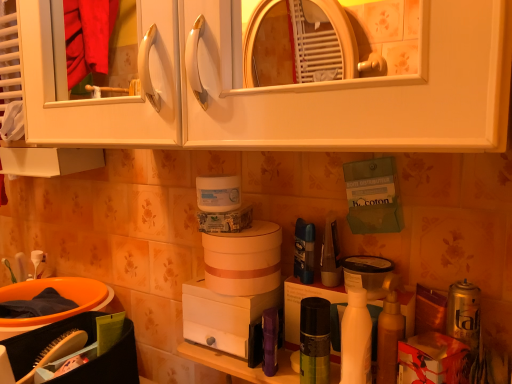
You are a GUI agent. You are given a task and a screenshot of the screen. Output one action in this format:
    pyautogui.click(x=<x>, y=<y>)
    Task: Click on the white matte cabinet at upper center
    Image resolution: width=512 pixels, height=384 pixels.
    Given the screenshot: What is the action you would take?
    pyautogui.click(x=274, y=85)

Describe the element at coordinates (356, 334) in the screenshot. I see `white matte bottle at center right` at that location.

This screenshot has height=384, width=512. What do you see at coordinates (270, 341) in the screenshot?
I see `purple fabric pouch at center, which appears as the 1th toiletry when viewed from the left` at bounding box center [270, 341].

Locate an element on the screen. white matte cabinet at upper center is located at coordinates (274, 85).

Which of these two, green matte spray can at center, placed as the 1th toiletry when sorted from right to left, or orange plastic basin at lower left, stands taller?

With more height is green matte spray can at center, placed as the 1th toiletry when sorted from right to left.

Which point is more forward, (x=328, y=333) or (x=15, y=325)?

Positioned in front is point (x=328, y=333).

Is green matte spray can at center, which ranks as the 2th toiletry in left-to-right order, completely or partially outside of orange plastic basin at lower left?

Absolutely, green matte spray can at center, which ranks as the 2th toiletry in left-to-right order, is external to orange plastic basin at lower left.

Which of these two, green matte spray can at center, placed as the 1th toiletry when sorted from right to left, or orange plastic basin at lower left, is wider?

orange plastic basin at lower left is wider.

Does orange plastic basin at lower left have a larger size compared to translucent plastic mouthwash at center right?

Yes, orange plastic basin at lower left is bigger than translucent plastic mouthwash at center right.

Between orange plastic basin at lower left and translucent plastic mouthwash at center right, which one has more height?

With more height is translucent plastic mouthwash at center right.

Is orange plastic basin at lower left in contact with translucent plastic mouthwash at center right?

No, orange plastic basin at lower left is not making contact with translucent plastic mouthwash at center right.

How far apart are orange plastic basin at lower left and translucent plastic mouthwash at center right?

orange plastic basin at lower left is 33.14 inches from translucent plastic mouthwash at center right.

Considering the relative sizes of translucent plastic mouthwash at center right and orange plastic basin at lower left in the image provided, is translucent plastic mouthwash at center right shorter than orange plastic basin at lower left?

No.

Based on the photo, would you say orange plastic basin at lower left is part of translucent plastic mouthwash at center right's contents?

No.

Which object is positioned more to the left, translucent plastic mouthwash at center right or orange plastic basin at lower left?

Positioned to the left is orange plastic basin at lower left.

From the image's perspective, which is below, translucent plastic mouthwash at center right or orange plastic basin at lower left?

orange plastic basin at lower left appears lower in the image.

Is purple fabric pouch at center, which is the second toiletry from right to left, smaller than orange plastic basin at lower left?

Indeed, purple fabric pouch at center, which is the second toiletry from right to left, has a smaller size compared to orange plastic basin at lower left.

Is orange plastic basin at lower left completely or partially inside purple fabric pouch at center, which appears as the 1th toiletry when viewed from the left?

No, orange plastic basin at lower left is located outside of purple fabric pouch at center, which appears as the 1th toiletry when viewed from the left.

Is the depth of purple fabric pouch at center, which is the second toiletry from right to left, greater than that of orange plastic basin at lower left?

No, the depth of purple fabric pouch at center, which is the second toiletry from right to left, is less than that of orange plastic basin at lower left.

Locate an element on the screen. The height and width of the screenshot is (384, 512). the 1st toiletry counting from the right of the orange plastic basin at lower left is located at coordinates (270, 341).

Does point (482, 100) come behind point (309, 379)?

No, (482, 100) is in front of (309, 379).

Is white matte cabinet at upper center directly adjacent to green matte spray can at center, which ranks as the 2th toiletry in left-to-right order?

No, white matte cabinet at upper center is not beside green matte spray can at center, which ranks as the 2th toiletry in left-to-right order.

Considering the sizes of objects white matte cabinet at upper center and green matte spray can at center, which ranks as the 2th toiletry in left-to-right order, in the image provided, who is thinner, white matte cabinet at upper center or green matte spray can at center, which ranks as the 2th toiletry in left-to-right order,?

green matte spray can at center, which ranks as the 2th toiletry in left-to-right order, is thinner.

Looking at this image, is white matte cabinet at upper center facing towards green matte spray can at center, which ranks as the 2th toiletry in left-to-right order?

No, white matte cabinet at upper center is not facing towards green matte spray can at center, which ranks as the 2th toiletry in left-to-right order.

Is white matte bottle at center right outside of green matte spray can at center, which ranks as the 2th toiletry in left-to-right order?

Yes, white matte bottle at center right is located beyond the bounds of green matte spray can at center, which ranks as the 2th toiletry in left-to-right order.

Could you tell me if white matte bottle at center right is facing green matte spray can at center, placed as the 1th toiletry when sorted from right to left?

No, white matte bottle at center right is not facing towards green matte spray can at center, placed as the 1th toiletry when sorted from right to left.

At what (x,y) coordinates should I click in order to perform the action: click on toiletry that is the 1st one when counting downward from the white matte bottle at center right (from the image's perspective). Please return your answer as a coordinate pair (x, y). Looking at the image, I should click on (315, 341).

Considering the relative sizes of green matte spray can at center, which ranks as the 2th toiletry in left-to-right order, and purple fabric pouch at center, which appears as the 1th toiletry when viewed from the left, in the image provided, is green matte spray can at center, which ranks as the 2th toiletry in left-to-right order, shorter than purple fabric pouch at center, which appears as the 1th toiletry when viewed from the left,?

In fact, green matte spray can at center, which ranks as the 2th toiletry in left-to-right order, may be taller than purple fabric pouch at center, which appears as the 1th toiletry when viewed from the left.

Between green matte spray can at center, placed as the 1th toiletry when sorted from right to left, and purple fabric pouch at center, which is the second toiletry from right to left, which one has larger width?

Wider between the two is green matte spray can at center, placed as the 1th toiletry when sorted from right to left.

From a real-world perspective, relative to purple fabric pouch at center, which appears as the 1th toiletry when viewed from the left, is green matte spray can at center, which ranks as the 2th toiletry in left-to-right order, vertically above or below?

In terms of real-world spatial position, green matte spray can at center, which ranks as the 2th toiletry in left-to-right order, is above purple fabric pouch at center, which appears as the 1th toiletry when viewed from the left.

Are green matte spray can at center, which ranks as the 2th toiletry in left-to-right order, and purple fabric pouch at center, which is the second toiletry from right to left, making contact?

Indeed, green matte spray can at center, which ranks as the 2th toiletry in left-to-right order, and purple fabric pouch at center, which is the second toiletry from right to left, are beside each other and touching.

At what (x,y) coordinates should I click in order to perform the action: click on sink behind the green matte spray can at center, which ranks as the 2th toiletry in left-to-right order. Please return your answer as a coordinate pair (x, y). This screenshot has height=384, width=512. Looking at the image, I should click on (60, 294).

Locate an element on the screen. Image resolution: width=512 pixels, height=384 pixels. sink on the left side of translucent plastic mouthwash at center right is located at coordinates (60, 294).

Considering their positions, is translucent plastic mouthwash at center right positioned closer to purple fabric pouch at center, which is the second toiletry from right to left, than white matte bottle at center right?

Among the two, white matte bottle at center right is located nearer to purple fabric pouch at center, which is the second toiletry from right to left.

Estimate the real-world distances between objects in this image. Which object is further from orange plastic basin at lower left, purple fabric pouch at center, which is the second toiletry from right to left, or white matte cabinet at upper center?

purple fabric pouch at center, which is the second toiletry from right to left, lies further to orange plastic basin at lower left than the other object.

Based on their spatial positions, is orange plastic basin at lower left or white matte cabinet at upper center closer to white matte bottle at center right?

Based on the image, white matte cabinet at upper center appears to be nearer to white matte bottle at center right.

Which object lies further to the anchor point white matte cabinet at upper center, purple fabric pouch at center, which is the second toiletry from right to left, or white matte bottle at center right?

purple fabric pouch at center, which is the second toiletry from right to left, lies further to white matte cabinet at upper center than the other object.

From the image, which object appears to be nearer to orange plastic basin at lower left, white matte cabinet at upper center or green matte spray can at center, which ranks as the 2th toiletry in left-to-right order?

Based on the image, white matte cabinet at upper center appears to be nearer to orange plastic basin at lower left.

From the image, which object appears to be farther from white matte cabinet at upper center, green matte spray can at center, which ranks as the 2th toiletry in left-to-right order, or orange plastic basin at lower left?

The object further to white matte cabinet at upper center is orange plastic basin at lower left.

Based on the photo, when comparing their distances from orange plastic basin at lower left, does purple fabric pouch at center, which appears as the 1th toiletry when viewed from the left, or white matte bottle at center right seem closer?

purple fabric pouch at center, which appears as the 1th toiletry when viewed from the left, lies closer to orange plastic basin at lower left than the other object.

Considering their positions, is translucent plastic mouthwash at center right positioned closer to white matte cabinet at upper center than white matte bottle at center right?

Among the two, white matte bottle at center right is located nearer to white matte cabinet at upper center.

You are a GUI agent. You are given a task and a screenshot of the screen. Output one action in this format:
    pyautogui.click(x=<x>, y=<y>)
    Task: Click on the cleaning product between green matte spray can at center, placed as the 1th toiletry when sorted from right to left, and translucent plastic mouthwash at center right, in the horizontal direction
    This screenshot has height=384, width=512.
    Given the screenshot: What is the action you would take?
    pyautogui.click(x=356, y=334)

The height and width of the screenshot is (384, 512). I want to click on cleaning product between white matte cabinet at upper center and green matte spray can at center, which ranks as the 2th toiletry in left-to-right order, vertically, so click(356, 334).

I want to click on cleaning product between purple fabric pouch at center, which appears as the 1th toiletry when viewed from the left, and translucent plastic mouthwash at center right, in the horizontal direction, so click(x=356, y=334).

Where is `toiletry situated between orange plastic basin at lower left and green matte spray can at center, which ranks as the 2th toiletry in left-to-right order, from left to right`? toiletry situated between orange plastic basin at lower left and green matte spray can at center, which ranks as the 2th toiletry in left-to-right order, from left to right is located at coordinates (270, 341).